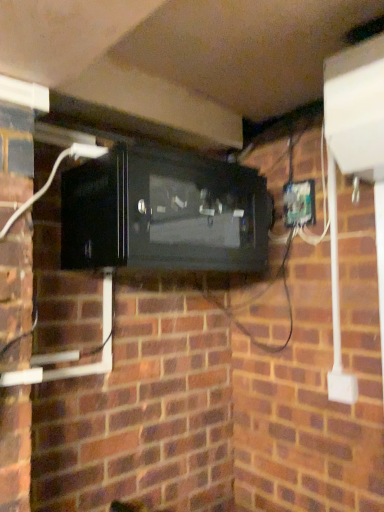
Question: Is green plastic electric outlet at right in front of or behind black glossy microwave at center in the image?

Choices:
 (A) behind
 (B) front

Answer: (A)

Question: Is green plastic electric outlet at right wider or thinner than black glossy microwave at center?

Choices:
 (A) thin
 (B) wide

Answer: (A)

Question: Looking at the image, does green plastic electric outlet at right seem bigger or smaller compared to black glossy microwave at center?

Choices:
 (A) big
 (B) small

Answer: (B)

Question: Is black glossy microwave at center taller or shorter than green plastic electric outlet at right?

Choices:
 (A) tall
 (B) short

Answer: (A)

Question: Is black glossy microwave at center wider or thinner than green plastic electric outlet at right?

Choices:
 (A) wide
 (B) thin

Answer: (A)

Question: From a real-world perspective, relative to green plastic electric outlet at right, is black glossy microwave at center vertically above or below?

Choices:
 (A) above
 (B) below

Answer: (B)

Question: Is black glossy microwave at center spatially inside green plastic electric outlet at right, or outside of it?

Choices:
 (A) outside
 (B) inside

Answer: (A)